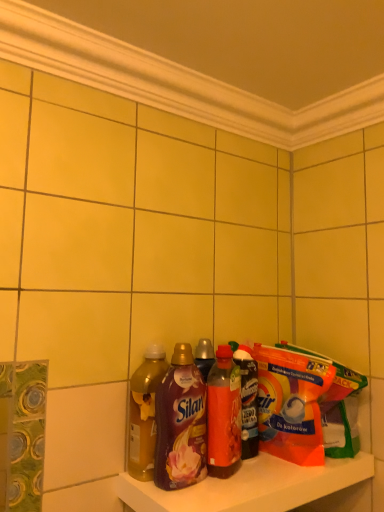
Find the location of a particular element. free space on the front side of translucent plastic bottle at center, placed as the 4th bottle when sorted from left to right is located at coordinates (254, 479).